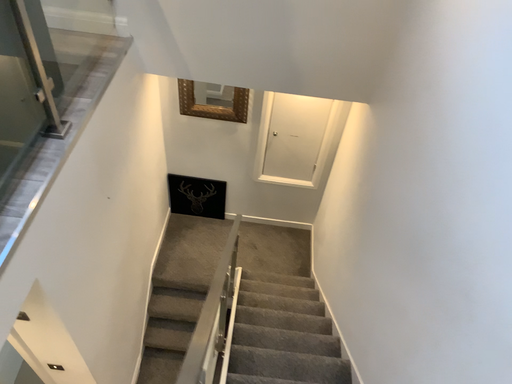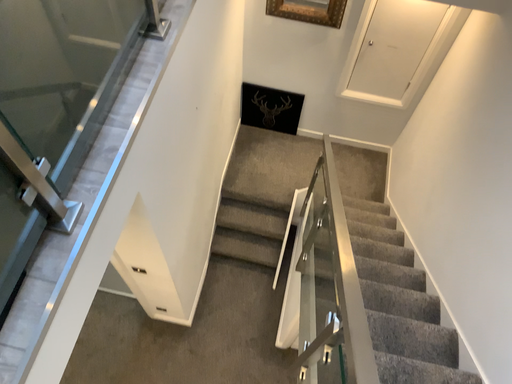
Question: Which way did the camera rotate in the video?

Choices:
 (A) rotated upward
 (B) rotated downward

Answer: (B)